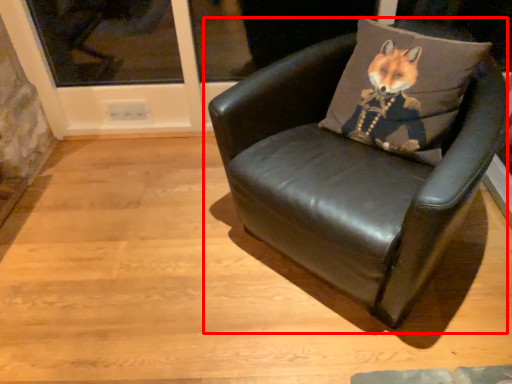
Question: From the image's perspective, what is the correct spatial relationship of chair (annotated by the red box) in relation to throw pillow?

Choices:
 (A) below
 (B) above

Answer: (A)